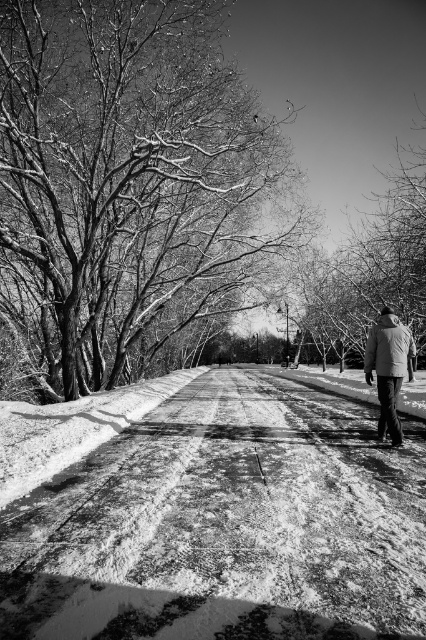
Question: Which of the following is the closest to the observer?

Choices:
 (A) (198, 148)
 (B) (383, 349)
 (C) (333, 298)
 (D) (167, 451)

Answer: (B)

Question: Is snow-covered branches at upper left positioned at the back of bare branches at upper center?

Choices:
 (A) yes
 (B) no

Answer: (B)

Question: Is snow-covered branches at upper left thinner than coated fabric jacket at lower right?

Choices:
 (A) yes
 (B) no

Answer: (B)

Question: Can you confirm if snowy asphalt road at center is bigger than coated fabric jacket at lower right?

Choices:
 (A) yes
 (B) no

Answer: (A)

Question: Which object appears closest to the camera in this image?

Choices:
 (A) coated fabric jacket at lower right
 (B) bare branches at upper center
 (C) snow-covered branches at upper left

Answer: (A)

Question: Which point is farther from the camera taking this photo?

Choices:
 (A) (423, 256)
 (B) (371, 380)
 (C) (100, 132)

Answer: (A)